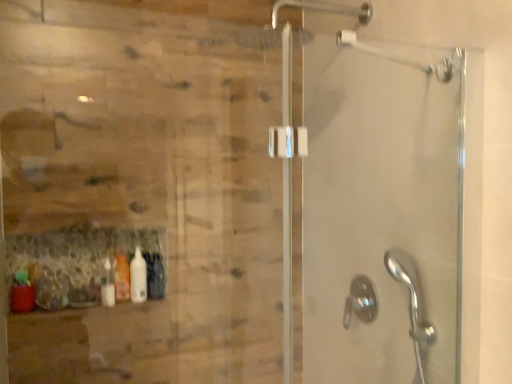
Question: Considering the relative positions of translucent plastic bottle at lower left, which ranks as the 2th bottle in right-to-left order, and satin nickel showerhead at lower right in the image provided, is translucent plastic bottle at lower left, which ranks as the 2th bottle in right-to-left order, to the left or to the right of satin nickel showerhead at lower right?

Choices:
 (A) right
 (B) left

Answer: (B)

Question: Is point (129, 284) positioned closer to the camera than point (346, 314)?

Choices:
 (A) farther
 (B) closer

Answer: (B)

Question: Which is nearer to the white glossy bottle at lower left, the second bottle positioned from the back?

Choices:
 (A) satin nickel showerhead at lower right
 (B) matte red bottle at lower left, acting as the 3th bottle starting from the back
 (C) translucent plastic bottle at lower left, the second bottle when ordered from left to right

Answer: (C)

Question: Which of these objects is positioned closest to the translucent plastic bottle at lower left, which appears as the first bottle when viewed from the back?

Choices:
 (A) matte red bottle at lower left, the first bottle in the left-to-right sequence
 (B) satin nickel showerhead at lower right
 (C) white glossy bottle at lower left, marked as the 1th bottle in a right-to-left arrangement

Answer: (C)